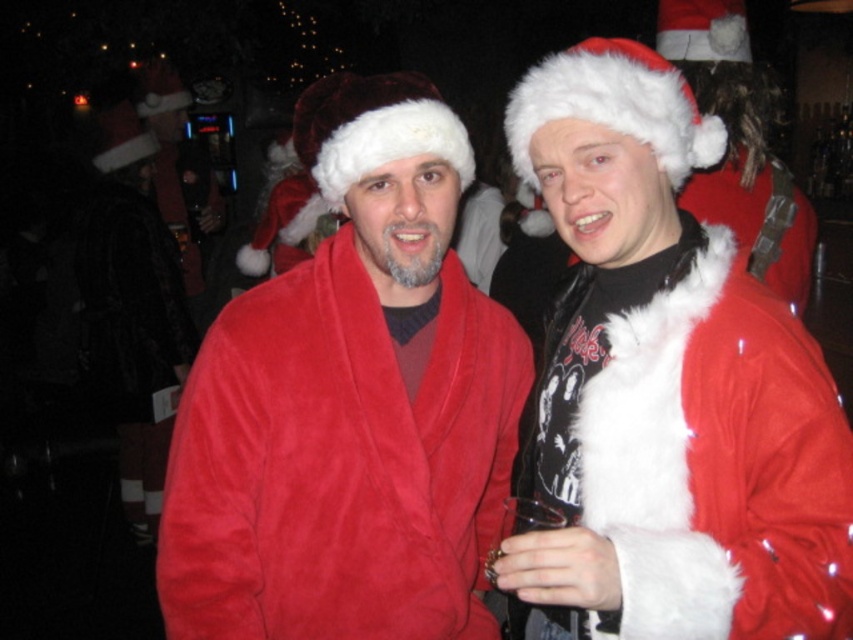
Who is taller, fuzzy red robe at right or fuzzy red coat at right?

With more height is fuzzy red coat at right.

Can you confirm if fuzzy red robe at right is bigger than fuzzy red coat at right?

Actually, fuzzy red robe at right might be smaller than fuzzy red coat at right.

Identify the location of fuzzy red robe at right. (715, 460).

Locate an element on the screen. Image resolution: width=853 pixels, height=640 pixels. fuzzy red robe at right is located at coordinates (715, 460).

Can you confirm if matte red robe at center is positioned above fuzzy red coat at right?

Incorrect, matte red robe at center is not positioned above fuzzy red coat at right.

Between matte red robe at center and fuzzy red coat at right, which one appears on the right side from the viewer's perspective?

fuzzy red coat at right

The height and width of the screenshot is (640, 853). I want to click on matte red robe at center, so click(350, 406).

Is point (314, 356) closer to viewer compared to point (514, 604)?

Yes, it is in front of point (514, 604).

Looking at this image, can you confirm if matte red robe at center is bigger than fuzzy red robe at right?

Correct, matte red robe at center is larger in size than fuzzy red robe at right.

Does point (364, 422) come closer to viewer compared to point (839, 444)?

No, (364, 422) is behind (839, 444).

Identify the location of matte red robe at center. (350, 406).